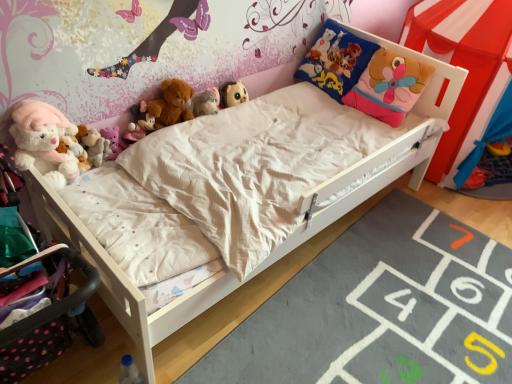
I want to click on vacant space behind blue plastic bottle at lower left, the 8th toy from the top, so click(x=157, y=346).